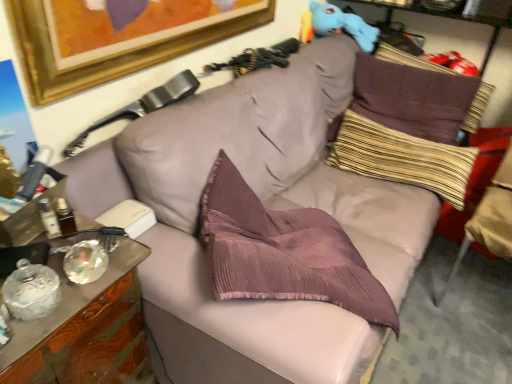
Find the location of `free space above wooden cabinet at left (from a real-world perspective)`. free space above wooden cabinet at left (from a real-world perspective) is located at coordinates (58, 260).